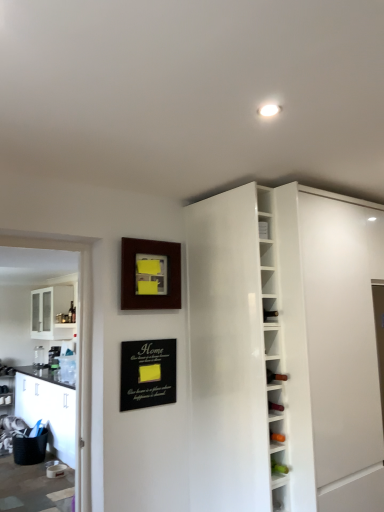
Question: Is wooden picture frame at upper center facing towards green matte bottle at lower right?

Choices:
 (A) no
 (B) yes

Answer: (A)

Question: Is wooden picture frame at upper center bigger than green matte bottle at lower right?

Choices:
 (A) yes
 (B) no

Answer: (A)

Question: Is the position of wooden picture frame at upper center less distant than that of green matte bottle at lower right?

Choices:
 (A) yes
 (B) no

Answer: (B)

Question: Can you confirm if wooden picture frame at upper center is smaller than green matte bottle at lower right?

Choices:
 (A) no
 (B) yes

Answer: (A)

Question: Does wooden picture frame at upper center have a greater width compared to green matte bottle at lower right?

Choices:
 (A) no
 (B) yes

Answer: (A)

Question: Considering the positions of white glossy cabinet at upper right and wooden picture frame at upper center in the image, is white glossy cabinet at upper right taller or shorter than wooden picture frame at upper center?

Choices:
 (A) short
 (B) tall

Answer: (B)

Question: Looking at their shapes, would you say white glossy cabinet at upper right is wider or thinner than wooden picture frame at upper center?

Choices:
 (A) wide
 (B) thin

Answer: (A)

Question: Considering the positions of point (306, 278) and point (137, 306), is point (306, 278) closer or farther from the camera than point (137, 306)?

Choices:
 (A) farther
 (B) closer

Answer: (B)

Question: In the image, is white glossy cabinet at upper right positioned in front of or behind wooden picture frame at upper center?

Choices:
 (A) behind
 (B) front

Answer: (B)

Question: Do you think green matte bottle at lower right is within black matte bulletin board at lower center, or outside of it?

Choices:
 (A) outside
 (B) inside

Answer: (A)

Question: Is green matte bottle at lower right in front of or behind black matte bulletin board at lower center in the image?

Choices:
 (A) front
 (B) behind

Answer: (A)

Question: From a real-world perspective, is green matte bottle at lower right positioned above or below black matte bulletin board at lower center?

Choices:
 (A) above
 (B) below

Answer: (B)

Question: Does point (274, 471) appear closer or farther from the camera than point (165, 355)?

Choices:
 (A) farther
 (B) closer

Answer: (B)

Question: Considering the positions of point (178, 271) and point (120, 373), is point (178, 271) closer or farther from the camera than point (120, 373)?

Choices:
 (A) closer
 (B) farther

Answer: (B)

Question: Is wooden picture frame at upper center bigger or smaller than black matte bulletin board at lower center?

Choices:
 (A) small
 (B) big

Answer: (B)